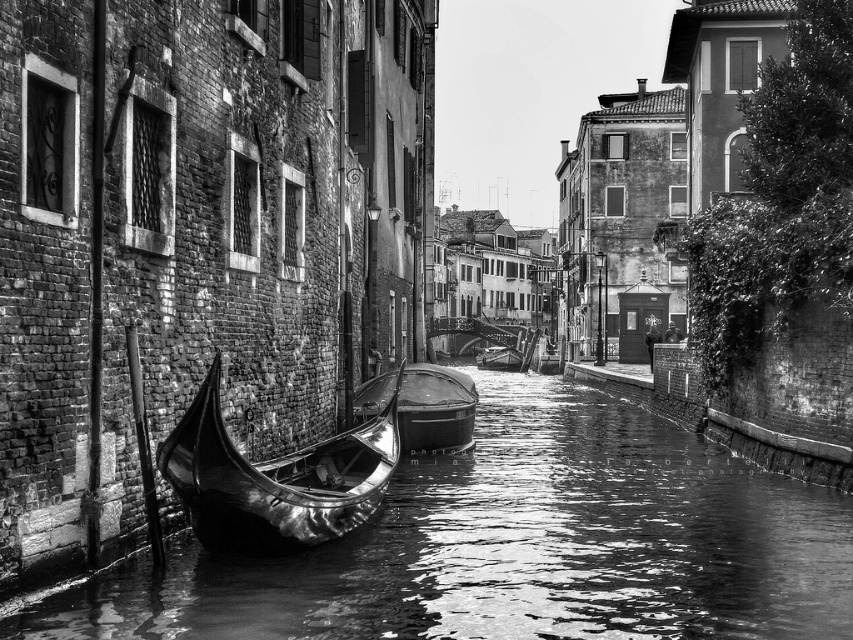
Question: Which point is farther from the camera taking this photo?

Choices:
 (A) (258, 545)
 (B) (460, 412)
 (C) (531, 416)

Answer: (C)

Question: Considering the relative positions of glossy wood canal at center and shiny black gondola at center in the image provided, where is glossy wood canal at center located with respect to shiny black gondola at center?

Choices:
 (A) left
 (B) right

Answer: (B)

Question: In this image, where is glossy wood canal at center located relative to shiny polished wood canoe at left?

Choices:
 (A) right
 (B) left

Answer: (A)

Question: Among these objects, which one is nearest to the camera?

Choices:
 (A) glossy wood canal at center
 (B) shiny black gondola at center
 (C) shiny polished wood canoe at left

Answer: (A)

Question: Is glossy wood canal at center bigger than shiny polished wood canoe at left?

Choices:
 (A) no
 (B) yes

Answer: (B)

Question: Which object is positioned farthest from the shiny polished wood canoe at left?

Choices:
 (A) glossy wood canal at center
 (B) shiny black gondola at center

Answer: (B)